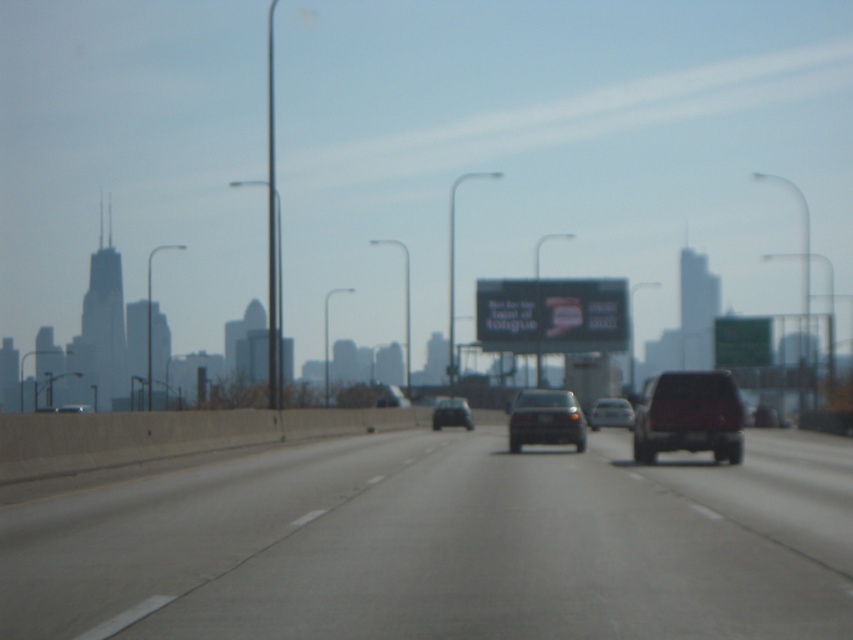
Question: Which of the following is the farthest from the observer?

Choices:
 (A) dark red matte suv at right
 (B) matte black car at center
 (C) black plastic license plate at center

Answer: (B)

Question: Does gray asphalt highway at center appear under black plastic license plate at center?

Choices:
 (A) no
 (B) yes

Answer: (B)

Question: Can you confirm if gray asphalt highway at center is bigger than black plastic license plate at center?

Choices:
 (A) no
 (B) yes

Answer: (B)

Question: Is gray asphalt highway at center wider than silver metallic sedan at center?

Choices:
 (A) no
 (B) yes

Answer: (B)

Question: Which point is farther to the camera?

Choices:
 (A) (572, 291)
 (B) (750, 353)

Answer: (A)

Question: Which of the following is the farthest from the observer?

Choices:
 (A) dark red matte suv at right
 (B) black glossy billboard at center

Answer: (B)